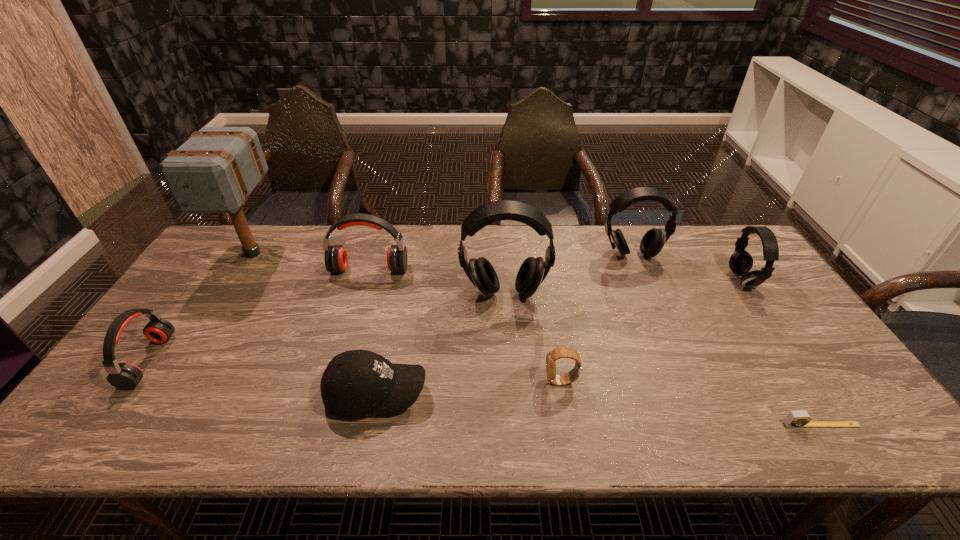
Where is `free region at the far left corner of the desktop`? The width and height of the screenshot is (960, 540). free region at the far left corner of the desktop is located at coordinates (258, 231).

At what (x,y) coordinates should I click in order to perform the action: click on free space at the far right corner of the desktop. Please return your answer as a coordinate pair (x, y). The image size is (960, 540). Looking at the image, I should click on (707, 264).

Identify the location of vacant area between the baseball cap and the smallest black earphone. (559, 336).

What are the coordinates of `free space between the tape measure and the rightmost earphone` in the screenshot? It's located at (781, 352).

This screenshot has width=960, height=540. Find the location of `vacant area that lies between the watch and the shortest object`. vacant area that lies between the watch and the shortest object is located at coordinates (691, 403).

Find the location of a particular element. This screenshot has height=540, width=960. free space between the gray mallet and the watch is located at coordinates (407, 318).

Find the location of a particular element. This screenshot has width=960, height=540. free spot between the watch and the black baseball cap is located at coordinates (468, 387).

Where is `vacant region between the second black earphone from right to left and the mallet`? Image resolution: width=960 pixels, height=540 pixels. vacant region between the second black earphone from right to left and the mallet is located at coordinates (x=443, y=254).

Where is `free space between the second tallest earphone and the rightmost black earphone`? This screenshot has height=540, width=960. free space between the second tallest earphone and the rightmost black earphone is located at coordinates (686, 267).

Find the location of a particular element. The height and width of the screenshot is (540, 960). empty space between the third earphone from right to left and the farther red earphone is located at coordinates (437, 281).